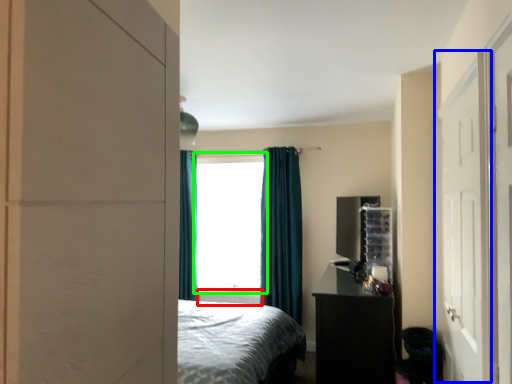
Question: Which object is positioned closest to radiator (highlighted by a red box)? Select from screen door (highlighted by a blue box) and window (highlighted by a green box).

Choices:
 (A) screen door
 (B) window

Answer: (B)